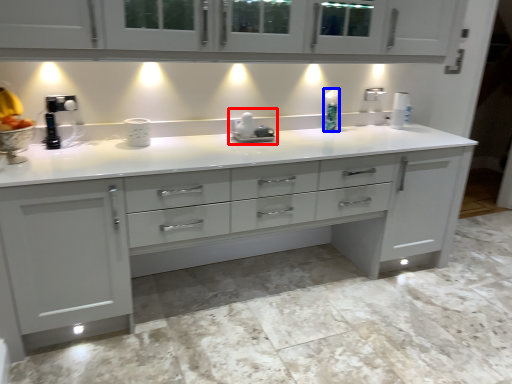
Question: Which object is further to the camera taking this photo, appliance (highlighted by a red box) or soap dispenser (highlighted by a blue box)?

Choices:
 (A) appliance
 (B) soap dispenser

Answer: (B)